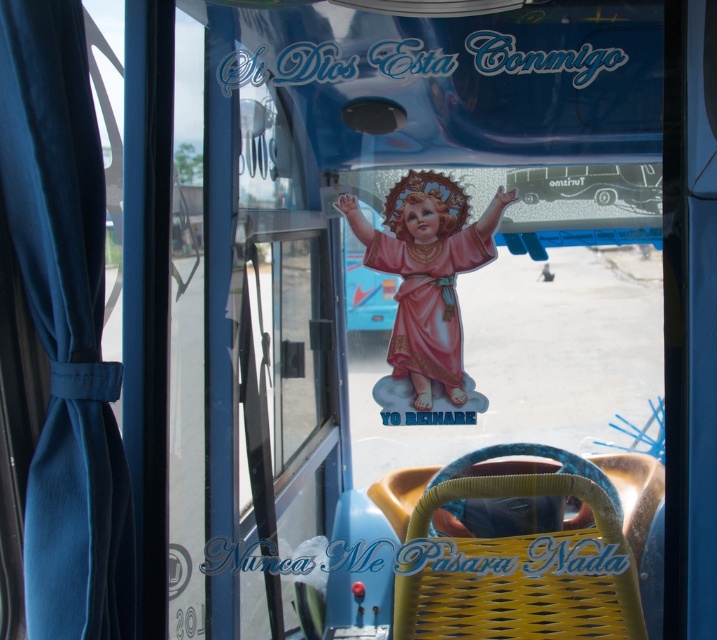
Question: Which point appears farthest from the camera in this image?

Choices:
 (A) (417, 529)
 (B) (118, 593)
 (C) (414, 298)

Answer: (C)

Question: Among these points, which one is farthest from the camera?

Choices:
 (A) (98, 236)
 (B) (483, 230)

Answer: (B)

Question: Is yellow woven basket at lower center below matte pink doll at center?

Choices:
 (A) yes
 (B) no

Answer: (A)

Question: Which of the following is the farthest from the observer?

Choices:
 (A) (437, 337)
 (B) (589, 490)
 (C) (56, 573)

Answer: (A)

Question: Does teal fabric curtain at left appear over matte pink doll at center?

Choices:
 (A) yes
 (B) no

Answer: (B)

Question: Is teal fabric curtain at left closer to the viewer compared to yellow woven basket at lower center?

Choices:
 (A) yes
 (B) no

Answer: (A)